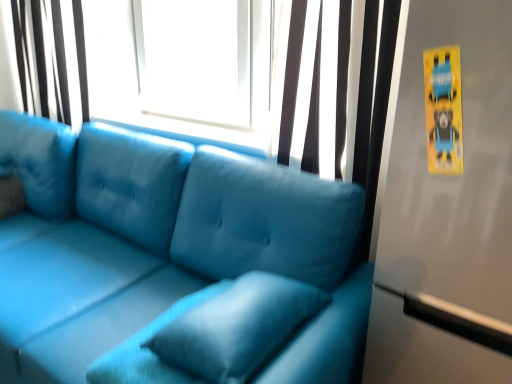
I want to click on vacant area on top of velvet blue pillow at center (from a real-world perspective), so click(x=256, y=320).